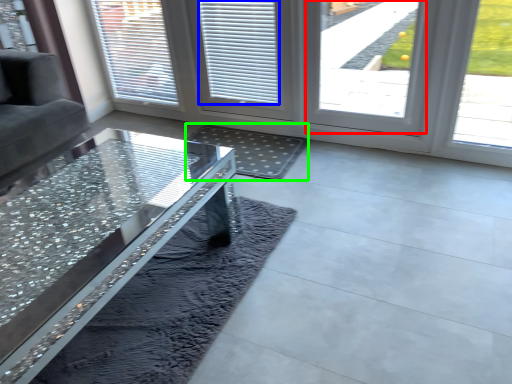
Question: Which is farther away from window (highlighted by a red box)? blind (highlighted by a blue box) or mat (highlighted by a green box)?

Choices:
 (A) blind
 (B) mat

Answer: (B)